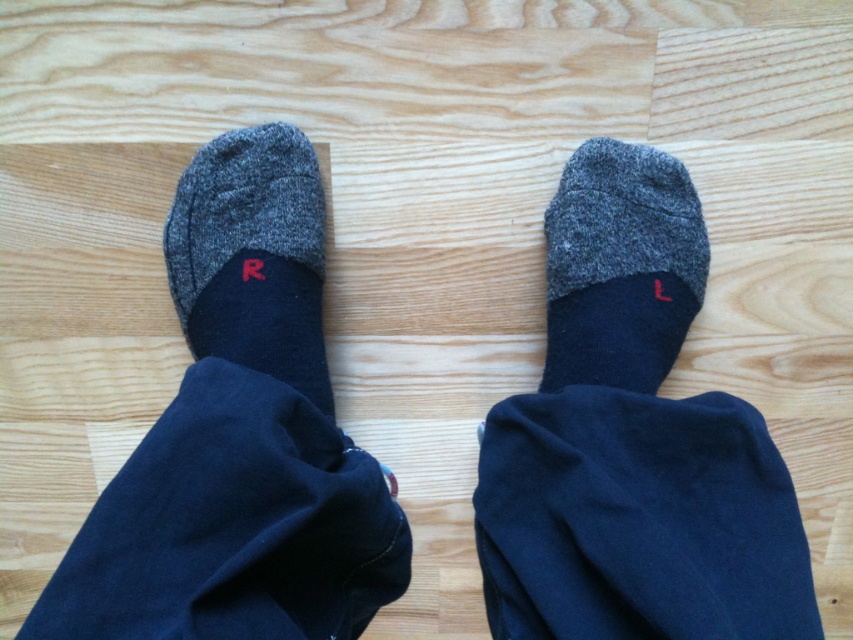
Question: Among these objects, which one is nearest to the camera?

Choices:
 (A) dark gray wool sock at left
 (B) gray woolen sock at center

Answer: (A)

Question: Can you confirm if gray woolen sock at center is thinner than dark gray wool sock at left?

Choices:
 (A) yes
 (B) no

Answer: (B)

Question: Does gray woolen sock at center appear over dark gray wool sock at left?

Choices:
 (A) no
 (B) yes

Answer: (B)

Question: Which point is closer to the camera taking this photo?

Choices:
 (A) (548, 241)
 (B) (305, 291)

Answer: (B)

Question: Can you confirm if gray woolen sock at center is positioned below dark gray wool sock at left?

Choices:
 (A) no
 (B) yes

Answer: (A)